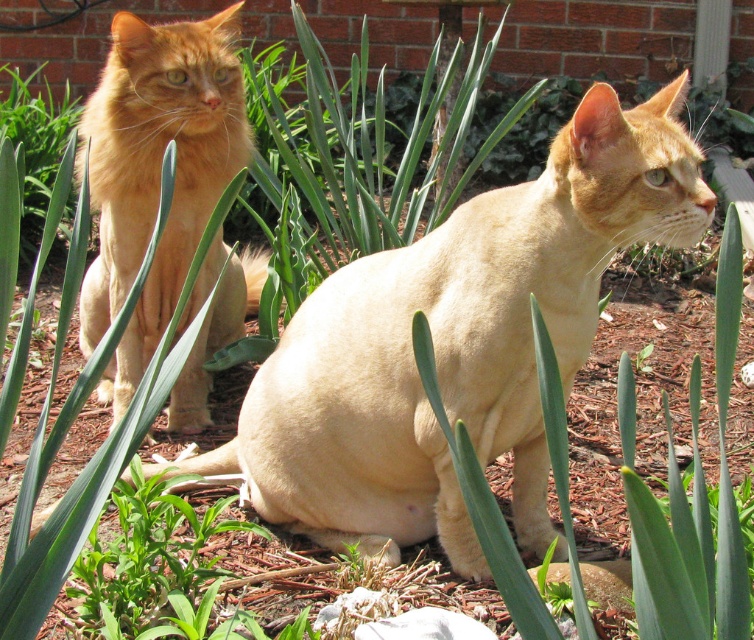
Question: Among these points, which one is nearest to the camera?

Choices:
 (A) (103, 390)
 (B) (348, 371)

Answer: (B)

Question: Does matte orange cat at left have a larger size compared to orange fur cat at upper left?

Choices:
 (A) yes
 (B) no

Answer: (B)

Question: Can you confirm if matte orange cat at left is positioned to the left of orange fur cat at upper left?

Choices:
 (A) yes
 (B) no

Answer: (B)

Question: Does matte orange cat at left come behind orange fur cat at upper left?

Choices:
 (A) yes
 (B) no

Answer: (B)

Question: Among these points, which one is farthest from the camera?

Choices:
 (A) (342, 438)
 (B) (143, 84)

Answer: (B)